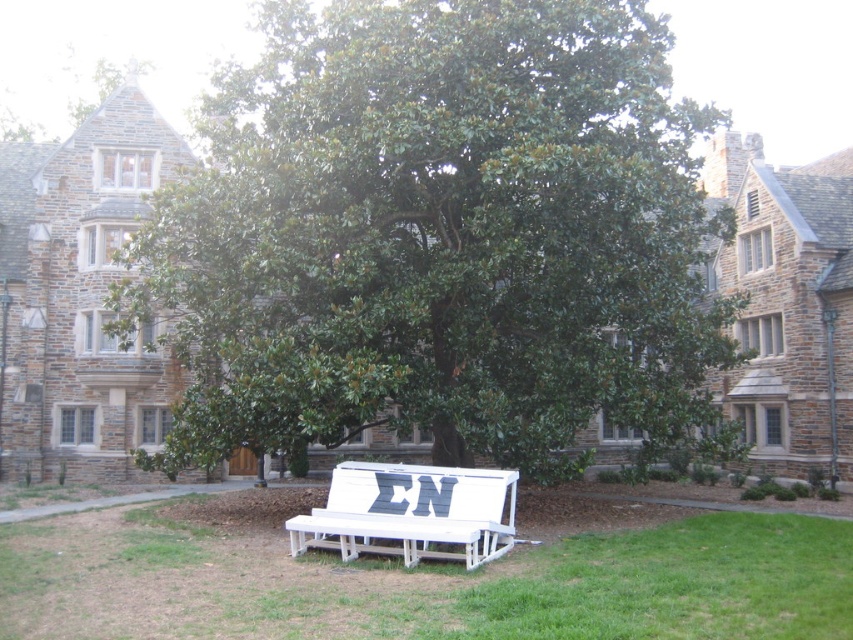
You are standing at the point marked by the coordinates point (444,237) in the image. What is the closest object to you?

The point (444,237) marks the green leafy tree at center, so the closest object to you is the green leafy tree at center.

You are planning to place a new flower pot between the white wooden bench at center and the white painted wood bench at center. Which bench should the flower pot be closer to if you want it to be as far as possible from the wider bench?

The white wooden bench at center might be wider than white painted wood bench at center, so to place the flower pot as far as possible from the wider bench, position it closer to the white painted wood bench at center.

You are sitting on the white wooden bench at center and want to look at the green leafy tree at center. Which direction should you turn your head to face the tree?

The green leafy tree at center is to the right of the white wooden bench at center, so you should turn your head to the right to face the tree.